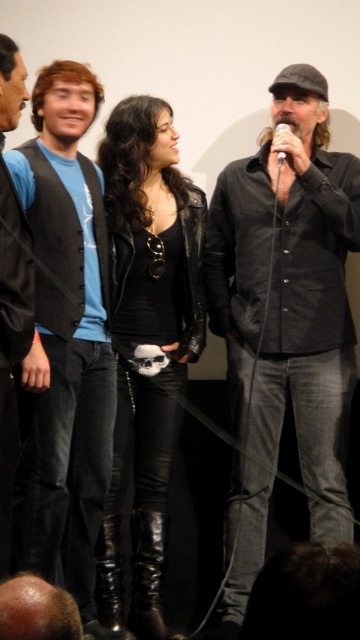
You are a photographer trying to capture a clear shot of the matte black vest at left and the black leather vest at left. Since both are on the same stage, which one is easier to see from your position in the audience?

The matte black vest at left is much taller than the black leather vest at left, so it is easier to see from the audience position.

You are a photographer trying to capture a group photo of the dark gray shirt at center and the matte black vest at left. If you want to ensure both are in focus, which one should you focus on first based on their positions?

The dark gray shirt at center has a greater height compared to the matte black vest at left. Therefore, you should focus on the dark gray shirt at center first since it is taller and likely closer to the camera.